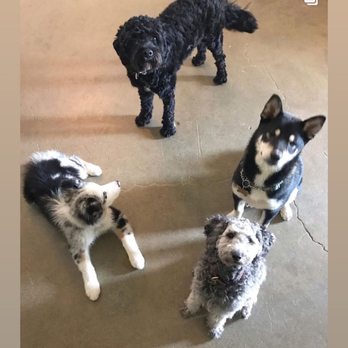
I want to click on cement floor, so click(x=308, y=25), click(x=76, y=107), click(x=71, y=38), click(x=180, y=124), click(x=247, y=127), click(x=199, y=146), click(x=153, y=184), click(x=163, y=265), click(x=39, y=296), click(x=291, y=333).